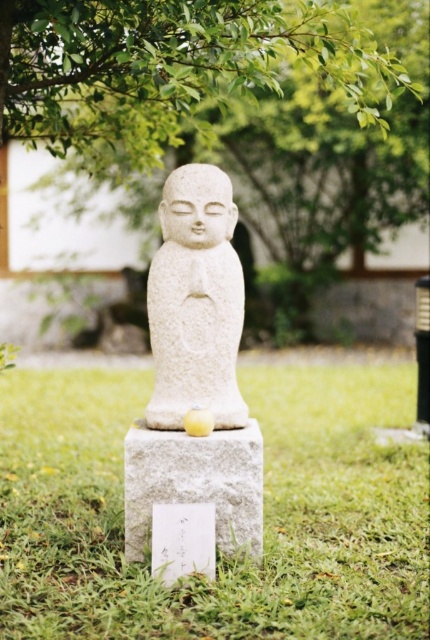
Question: Where is green grass at center located in relation to white stone statue at center in the image?

Choices:
 (A) left
 (B) right

Answer: (B)

Question: Which point is farther from the camera taking this photo?

Choices:
 (A) (316, 54)
 (B) (269, 392)
 (C) (251, 490)
 (D) (169, 372)

Answer: (B)

Question: Does green leafy tree at upper center have a greater width compared to white stone statue at center?

Choices:
 (A) no
 (B) yes

Answer: (B)

Question: Considering the relative positions of green leafy tree at upper center and white stone statue at center in the image provided, where is green leafy tree at upper center located with respect to white stone statue at center?

Choices:
 (A) above
 (B) below

Answer: (A)

Question: Which of these objects is positioned farthest from the smooth gray stone at center?

Choices:
 (A) white stone statue at center
 (B) green grass at center
 (C) green leafy tree at upper center

Answer: (C)

Question: Estimate the real-world distances between objects in this image. Which object is closer to the white stone statue at center?

Choices:
 (A) smooth gray stone at center
 (B) green grass at center
 (C) green leafy tree at upper center

Answer: (A)